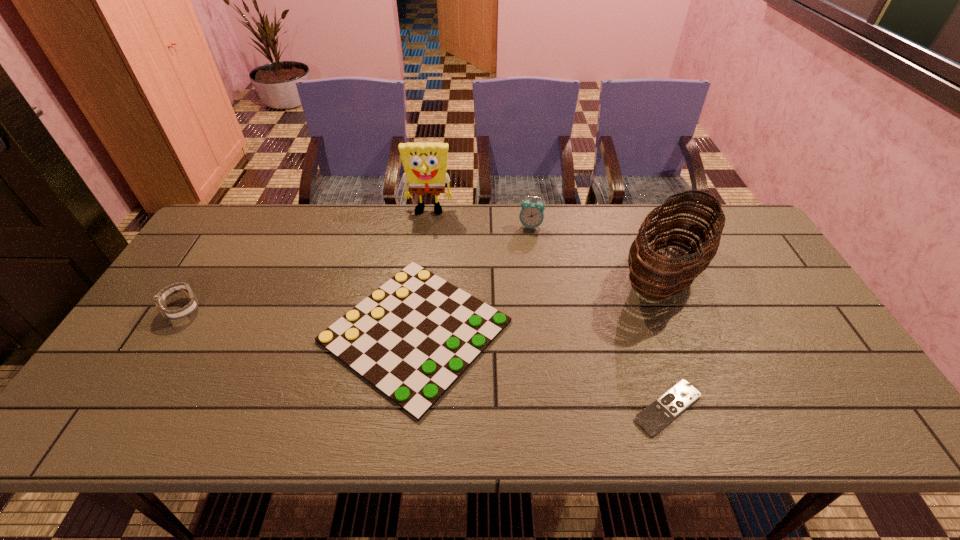
Identify the location of blank space located 0.300m on the front of the basket. (730, 430).

This screenshot has height=540, width=960. Identify the location of vacant area located 0.250m on the face of the fourth shortest object. (539, 287).

What are the coordinates of `free spot located 0.080m on the face of the third shortest object` in the screenshot? It's located at (157, 349).

The image size is (960, 540). Find the location of `vacant space positioned on the right of the fifth tallest object`. vacant space positioned on the right of the fifth tallest object is located at coordinates (588, 331).

I want to click on vacant space located on the left of the shortest object, so click(564, 408).

At what (x,y) coordinates should I click in order to perform the action: click on sponge that is at the far edge. Please return your answer as a coordinate pair (x, y). The width and height of the screenshot is (960, 540). Looking at the image, I should click on (425, 164).

Locate an element on the screen. The image size is (960, 540). basket at the far edge is located at coordinates click(658, 276).

Identify the location of alarm clock positioned at the far edge. The image size is (960, 540). (531, 215).

The height and width of the screenshot is (540, 960). In order to click on checkerboard present at the near edge in this screenshot , I will do `click(412, 338)`.

Find the location of `remote control situated at the near edge`. remote control situated at the near edge is located at coordinates (662, 411).